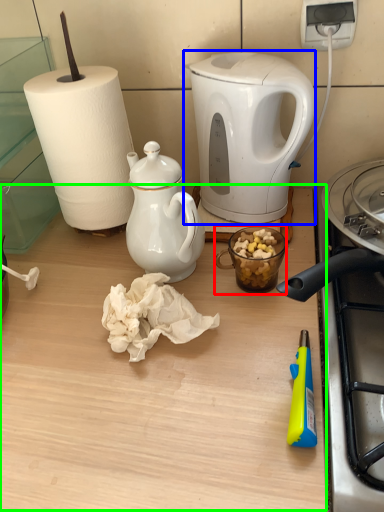
Question: Estimate the real-world distances between objects in this image. Which object is farther from coffee cup (highlighted by a red box), kettle (highlighted by a blue box) or table (highlighted by a green box)?

Choices:
 (A) kettle
 (B) table

Answer: (B)